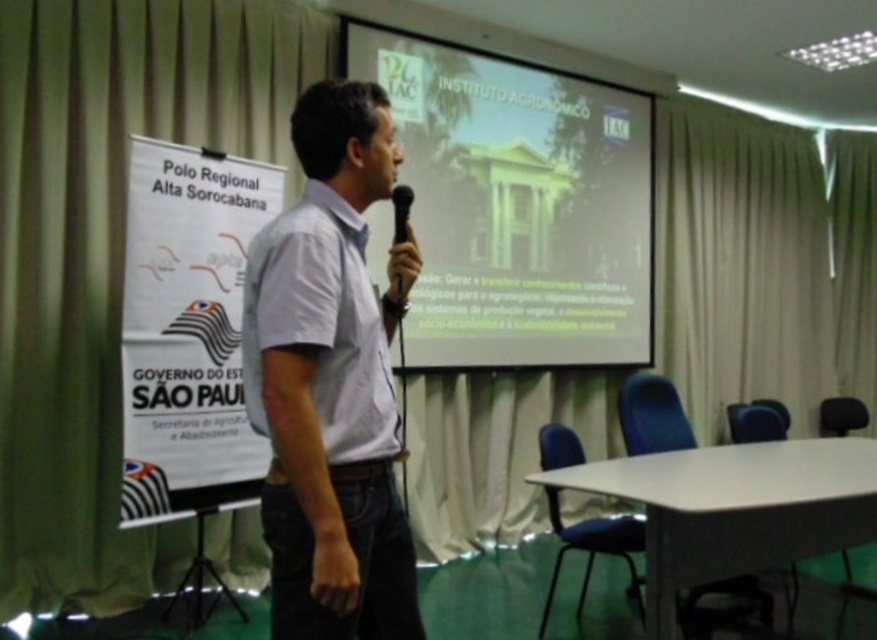
You are an event organizer who needs to ensure the projector screen is visible to all attendees. Considering the sizes of the white glossy projector screen at upper center and the white matte shirt at center, which one is more likely to catch the audience members attention from a distance?

The white glossy projector screen at upper center has a larger size compared to the white matte shirt at center, so it is more likely to catch the audience members attention from a distance.